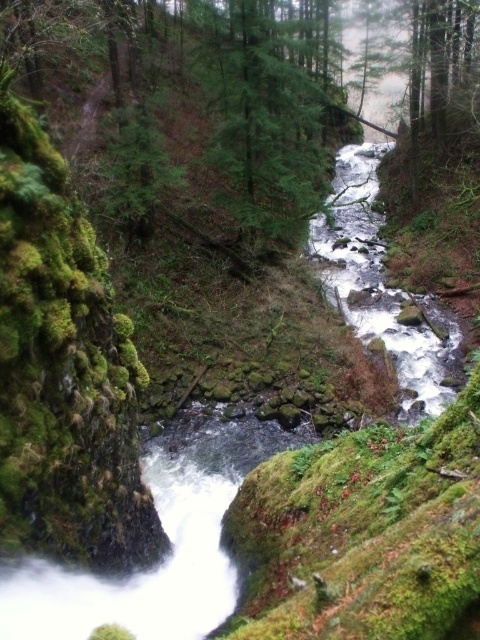
Question: Can you confirm if green mossy tree at center is positioned to the left of white frothy water at center?

Choices:
 (A) yes
 (B) no

Answer: (A)

Question: Among these objects, which one is nearest to the camera?

Choices:
 (A) green mossy tree at center
 (B) white frothy water at center

Answer: (A)

Question: Can you confirm if green mossy tree at center is positioned to the right of white frothy water at center?

Choices:
 (A) yes
 (B) no

Answer: (B)

Question: Can you confirm if green mossy tree at center is thinner than white frothy water at center?

Choices:
 (A) yes
 (B) no

Answer: (B)

Question: Which point is closer to the camera?

Choices:
 (A) (123, 58)
 (B) (432, 410)

Answer: (B)